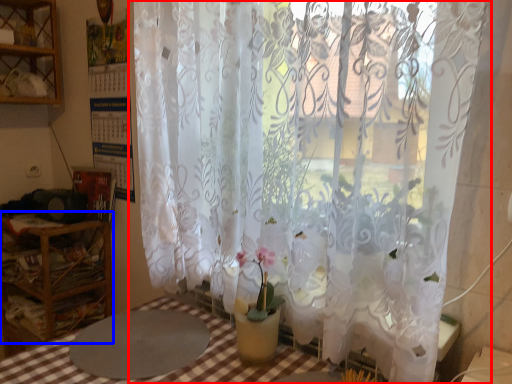
Question: Which object is further to the camera taking this photo, curtain (highlighted by a red box) or furniture (highlighted by a blue box)?

Choices:
 (A) curtain
 (B) furniture

Answer: (B)